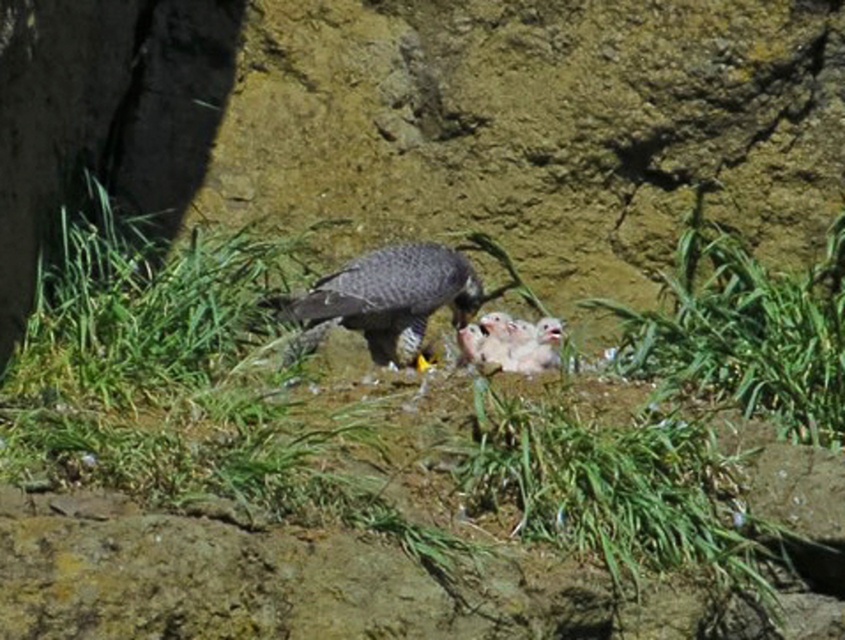
Question: Is the position of dark gray speckled falcon at center more distant than that of soft white downy chicks at center?

Choices:
 (A) yes
 (B) no

Answer: (B)

Question: Is dark gray speckled falcon at center behind soft white downy chicks at center?

Choices:
 (A) no
 (B) yes

Answer: (A)

Question: Which object is positioned closest to the soft white downy chicks at center?

Choices:
 (A) dark gray speckled falcon at center
 (B) green grass at center

Answer: (A)

Question: Estimate the real-world distances between objects in this image. Which object is closer to the green grass at center?

Choices:
 (A) dark gray speckled falcon at center
 (B) soft white downy chicks at center

Answer: (A)

Question: Which point is closer to the camera taking this photo?

Choices:
 (A) (413, 314)
 (B) (668, 611)
 (C) (499, 323)

Answer: (B)

Question: Can you confirm if dark gray speckled falcon at center is positioned to the left of soft white downy chicks at center?

Choices:
 (A) yes
 (B) no

Answer: (A)